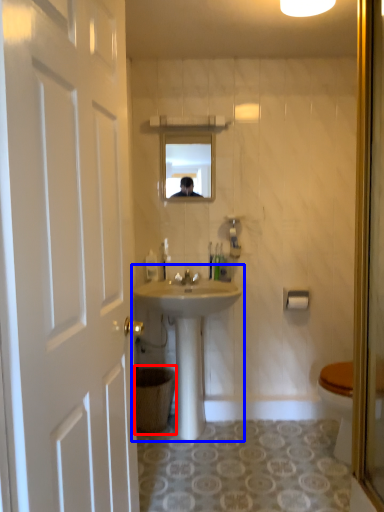
Question: Which object is closer to the camera taking this photo, trash bin/can (highlighted by a red box) or sink (highlighted by a blue box)?

Choices:
 (A) trash bin/can
 (B) sink

Answer: (B)